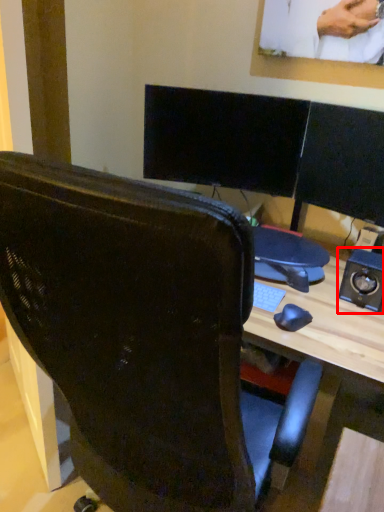
Question: From the image's perspective, where is speaker (annotated by the red box) located in relation to chair in the image?

Choices:
 (A) below
 (B) above

Answer: (B)